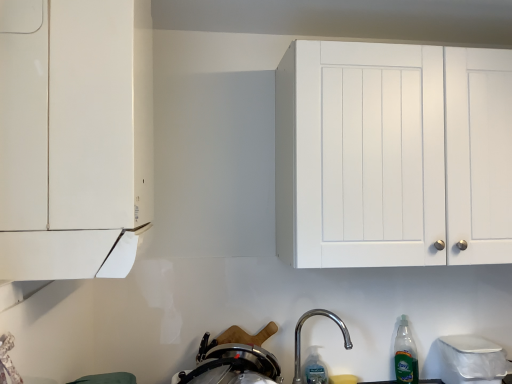
Question: Can you confirm if green translucent bottle at lower right, which is counted as the first bottle, starting from the right, is positioned to the right of white matte cabinet at upper right, which appears as the first cabinetry when viewed from the back?

Choices:
 (A) yes
 (B) no

Answer: (B)

Question: Does green translucent bottle at lower right, the second bottle viewed from the left, lie behind white matte cabinet at upper right, the first cabinetry positioned from the right?

Choices:
 (A) yes
 (B) no

Answer: (A)

Question: Is green translucent bottle at lower right, which is counted as the first bottle, starting from the right, taller than white matte cabinet at upper right, which appears as the second cabinetry when viewed from the front?

Choices:
 (A) yes
 (B) no

Answer: (B)

Question: From a real-world perspective, is green translucent bottle at lower right, which is counted as the first bottle, starting from the right, under white matte cabinet at upper right, the first cabinetry positioned from the right?

Choices:
 (A) yes
 (B) no

Answer: (A)

Question: Is green translucent bottle at lower right, which is counted as the first bottle, starting from the right, positioned far away from white matte cabinet at upper right, the first cabinetry positioned from the right?

Choices:
 (A) no
 (B) yes

Answer: (A)

Question: From the image's perspective, is green translucent bottle at lower right, the second bottle viewed from the left, located beneath white matte cabinet at upper right, the first cabinetry positioned from the right?

Choices:
 (A) yes
 (B) no

Answer: (A)

Question: Considering the relative sizes of stainless steel pot at lower center and green translucent bottle at lower right, the second bottle viewed from the left, in the image provided, is stainless steel pot at lower center shorter than green translucent bottle at lower right, the second bottle viewed from the left,?

Choices:
 (A) no
 (B) yes

Answer: (B)

Question: From a real-world perspective, is stainless steel pot at lower center below green translucent bottle at lower right, the second bottle viewed from the left?

Choices:
 (A) yes
 (B) no

Answer: (B)

Question: Can you confirm if stainless steel pot at lower center is positioned to the right of green translucent bottle at lower right, the second bottle viewed from the left?

Choices:
 (A) yes
 (B) no

Answer: (B)

Question: Would you say green translucent bottle at lower right, which is counted as the first bottle, starting from the right, is part of stainless steel pot at lower center's contents?

Choices:
 (A) no
 (B) yes

Answer: (A)

Question: Is stainless steel pot at lower center facing towards green translucent bottle at lower right, which is counted as the first bottle, starting from the right?

Choices:
 (A) yes
 (B) no

Answer: (B)

Question: From a real-world perspective, is stainless steel pot at lower center physically above green translucent bottle at lower right, which is counted as the first bottle, starting from the right?

Choices:
 (A) yes
 (B) no

Answer: (A)

Question: Does polished metallic faucet at lower center have a lesser width compared to green translucent bottle at lower right, the second bottle viewed from the left?

Choices:
 (A) yes
 (B) no

Answer: (B)